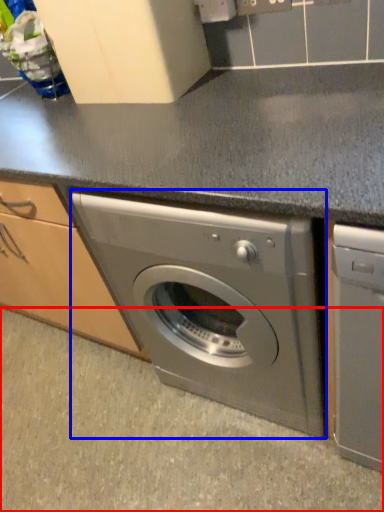
Question: Which of the following is the closest to the observer, granite (highlighted by a red box) or washing machine (highlighted by a blue box)?

Choices:
 (A) granite
 (B) washing machine

Answer: (B)